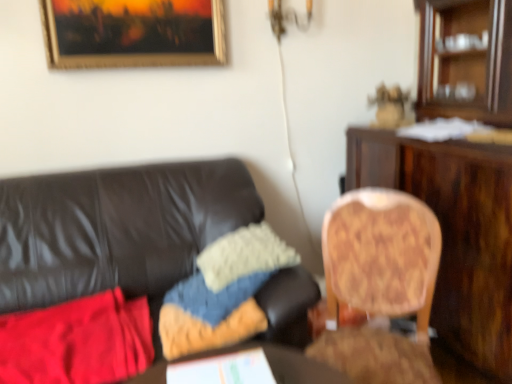
Question: Does wooden round table at center lie behind wooden cabinet at upper right?

Choices:
 (A) yes
 (B) no

Answer: (B)

Question: Does wooden round table at center touch wooden cabinet at upper right?

Choices:
 (A) no
 (B) yes

Answer: (A)

Question: From a real-world perspective, does wooden round table at center stand above wooden cabinet at upper right?

Choices:
 (A) no
 (B) yes

Answer: (A)

Question: Can you confirm if wooden round table at center is shorter than wooden cabinet at upper right?

Choices:
 (A) yes
 (B) no

Answer: (A)

Question: Considering the relative sizes of wooden round table at center and wooden cabinet at upper right in the image provided, is wooden round table at center thinner than wooden cabinet at upper right?

Choices:
 (A) no
 (B) yes

Answer: (B)

Question: Relative to gold-framed painting at upper center, is wooden chair at right, which appears as the 2th chair when viewed from the left, in front or behind?

Choices:
 (A) front
 (B) behind

Answer: (A)

Question: From a real-world perspective, is wooden chair at right, which appears as the 2th chair when viewed from the left, physically located above or below gold-framed painting at upper center?

Choices:
 (A) above
 (B) below

Answer: (B)

Question: Is point (426, 324) positioned closer to the camera than point (215, 23)?

Choices:
 (A) closer
 (B) farther

Answer: (A)

Question: Is wooden chair at right, which appears as the 2th chair when viewed from the left, situated inside gold-framed painting at upper center or outside?

Choices:
 (A) outside
 (B) inside

Answer: (A)

Question: Is wooden chair at right, the 1th chair in the left-to-right sequence, in front of or behind knitted fabric pillow at center, the 2th pillow positioned from the top, in the image?

Choices:
 (A) front
 (B) behind

Answer: (A)

Question: Is wooden chair at right, the 1th chair in the left-to-right sequence, bigger or smaller than knitted fabric pillow at center, the 2th pillow positioned from the top?

Choices:
 (A) small
 (B) big

Answer: (B)

Question: From the image's perspective, is wooden chair at right, arranged as the second chair when viewed from the right, above or below knitted fabric pillow at center, the 2th pillow positioned from the top?

Choices:
 (A) below
 (B) above

Answer: (B)

Question: Considering the positions of point (15, 220) and point (192, 288), is point (15, 220) closer or farther from the camera than point (192, 288)?

Choices:
 (A) farther
 (B) closer

Answer: (A)

Question: From a real-world perspective, relative to wooden desk at right, is knitted fabric pillow at center, the 2th pillow positioned from the top, vertically above or below?

Choices:
 (A) below
 (B) above

Answer: (A)

Question: Is knitted fabric pillow at center, which is the 1th pillow from bottom to top, inside the boundaries of wooden desk at right, or outside?

Choices:
 (A) outside
 (B) inside

Answer: (A)